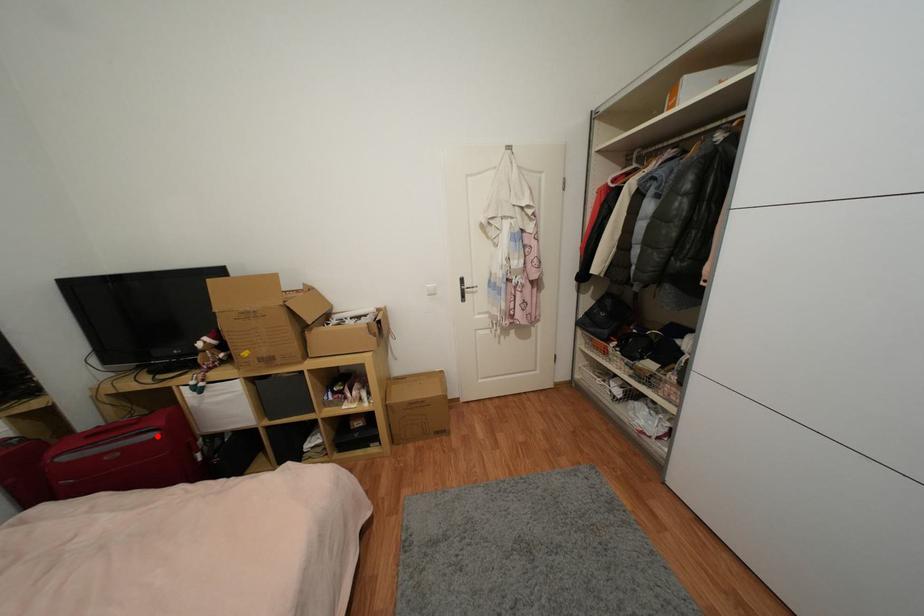
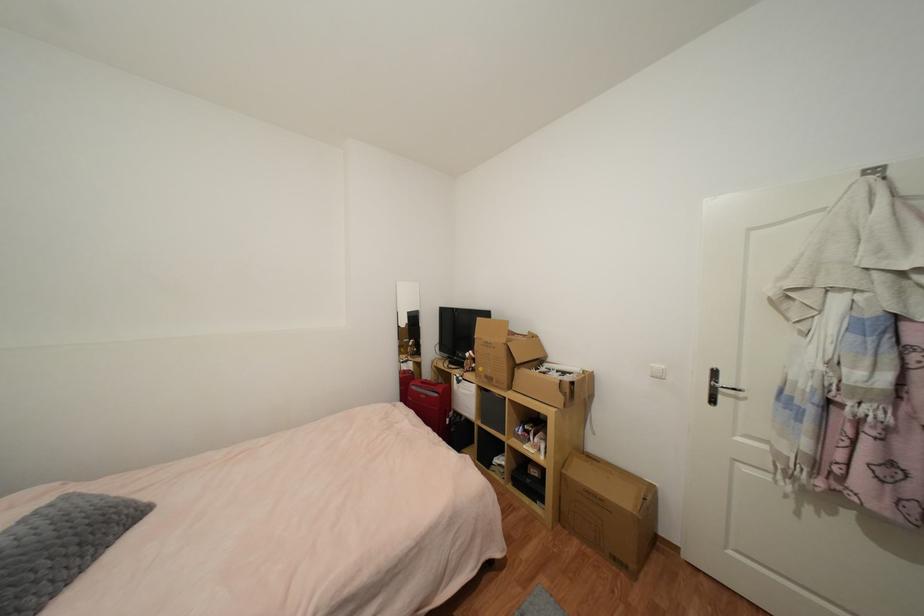
Question: I am providing you with two images of the same scene from different viewpoints. Given a red point in image1, look at the same physical point in image2. Is it:

Choices:
 (A) Closer to the viewpoint
 (B) Farther from the viewpoint

Answer: (B)